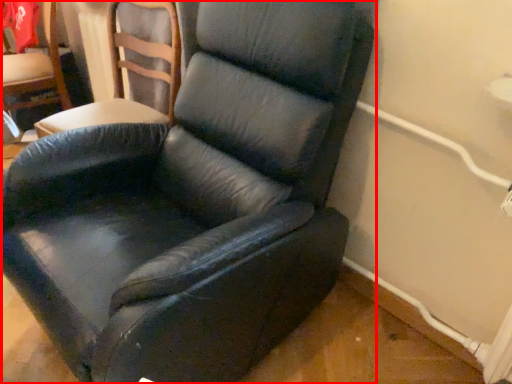
Question: From the image's perspective, what is the correct spatial relationship of chair (annotated by the red box) in relation to chair?

Choices:
 (A) below
 (B) above

Answer: (A)